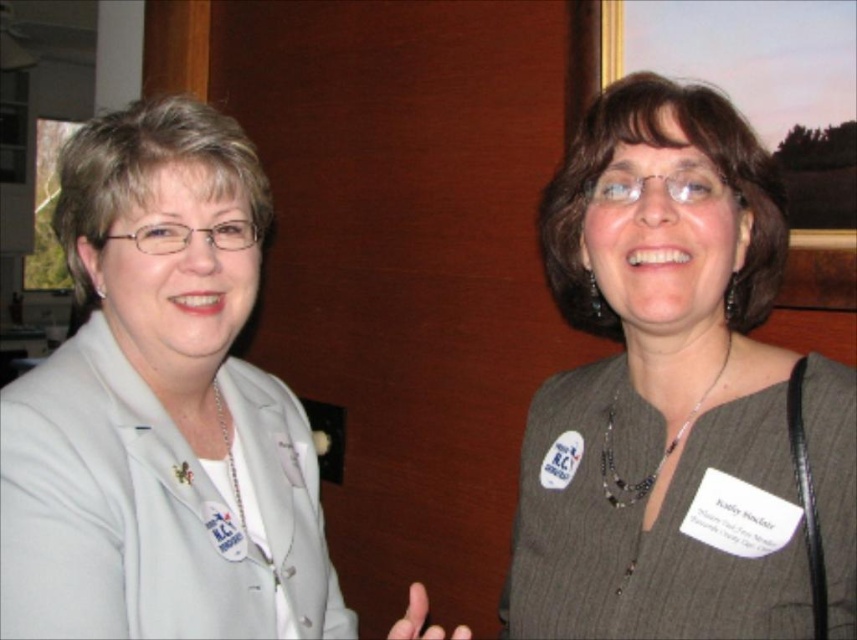
Question: Which point is closer to the camera?

Choices:
 (A) white fabric at left
 (B) gray textured blazer at upper right
 (C) matte plastic picture frame at upper right

Answer: (A)

Question: Is gray textured blazer at upper right further to the viewer compared to matte plastic picture frame at upper right?

Choices:
 (A) yes
 (B) no

Answer: (B)

Question: Which point is farther to the camera?

Choices:
 (A) gray textured blazer at upper right
 (B) white fabric at left

Answer: (A)

Question: In this image, where is white fabric at left located relative to matte plastic picture frame at upper right?

Choices:
 (A) below
 (B) above

Answer: (A)

Question: Does white fabric at left appear over matte plastic picture frame at upper right?

Choices:
 (A) yes
 (B) no

Answer: (B)

Question: Which object is positioned farthest from the matte plastic picture frame at upper right?

Choices:
 (A) gray textured blazer at upper right
 (B) white fabric at left

Answer: (B)